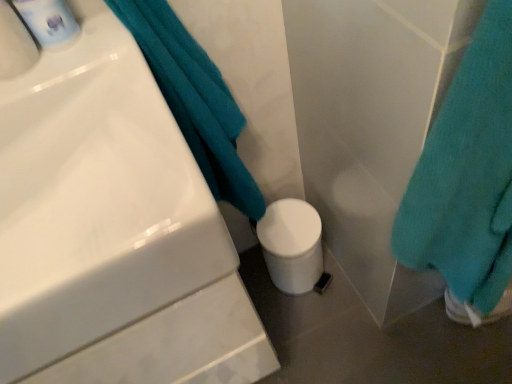
Question: Is teal soft towel at lower right, which is counted as the first bath towel, starting from the right, behind teal soft towel at upper left, the 1th bath towel positioned from the left?

Choices:
 (A) yes
 (B) no

Answer: (B)

Question: Is teal soft towel at lower right, which is counted as the first bath towel, starting from the right, wider than teal soft towel at upper left, which appears as the second bath towel when viewed from the right?

Choices:
 (A) no
 (B) yes

Answer: (B)

Question: Does teal soft towel at lower right, which is counted as the first bath towel, starting from the right, have a larger size compared to teal soft towel at upper left, which appears as the second bath towel when viewed from the right?

Choices:
 (A) no
 (B) yes

Answer: (B)

Question: Is teal soft towel at lower right, which is counted as the first bath towel, starting from the right, facing towards teal soft towel at upper left, which appears as the second bath towel when viewed from the right?

Choices:
 (A) no
 (B) yes

Answer: (A)

Question: From a real-world perspective, is teal soft towel at lower right, which is counted as the first bath towel, starting from the right, physically below teal soft towel at upper left, the 1th bath towel positioned from the left?

Choices:
 (A) no
 (B) yes

Answer: (B)

Question: Do you think white glossy sink at upper left is within teal soft towel at upper left, the 1th bath towel positioned from the left, or outside of it?

Choices:
 (A) outside
 (B) inside

Answer: (A)

Question: Considering the positions of point (81, 370) and point (140, 1), is point (81, 370) closer or farther from the camera than point (140, 1)?

Choices:
 (A) farther
 (B) closer

Answer: (B)

Question: Based on their sizes in the image, would you say white glossy sink at upper left is bigger or smaller than teal soft towel at upper left, the 1th bath towel positioned from the left?

Choices:
 (A) big
 (B) small

Answer: (A)

Question: From the image's perspective, is white glossy sink at upper left above or below teal soft towel at upper left, which appears as the second bath towel when viewed from the right?

Choices:
 (A) above
 (B) below

Answer: (B)

Question: Is point (438, 233) closer or farther from the camera than point (173, 266)?

Choices:
 (A) farther
 (B) closer

Answer: (A)

Question: In terms of width, does teal soft towel at lower right, which is counted as the first bath towel, starting from the right, look wider or thinner when compared to white glossy sink at upper left?

Choices:
 (A) thin
 (B) wide

Answer: (A)

Question: From a real-world perspective, relative to white glossy sink at upper left, is teal soft towel at lower right, which is counted as the first bath towel, starting from the right, vertically above or below?

Choices:
 (A) below
 (B) above

Answer: (A)

Question: Would you say teal soft towel at lower right, the 2th bath towel viewed from the left, is to the left or to the right of white glossy sink at upper left in the picture?

Choices:
 (A) left
 (B) right

Answer: (B)

Question: Is point (510, 117) positioned closer to the camera than point (233, 137)?

Choices:
 (A) farther
 (B) closer

Answer: (B)

Question: From a real-world perspective, relative to teal soft towel at upper left, which appears as the second bath towel when viewed from the right, is teal soft towel at lower right, the 2th bath towel viewed from the left, vertically above or below?

Choices:
 (A) above
 (B) below

Answer: (B)